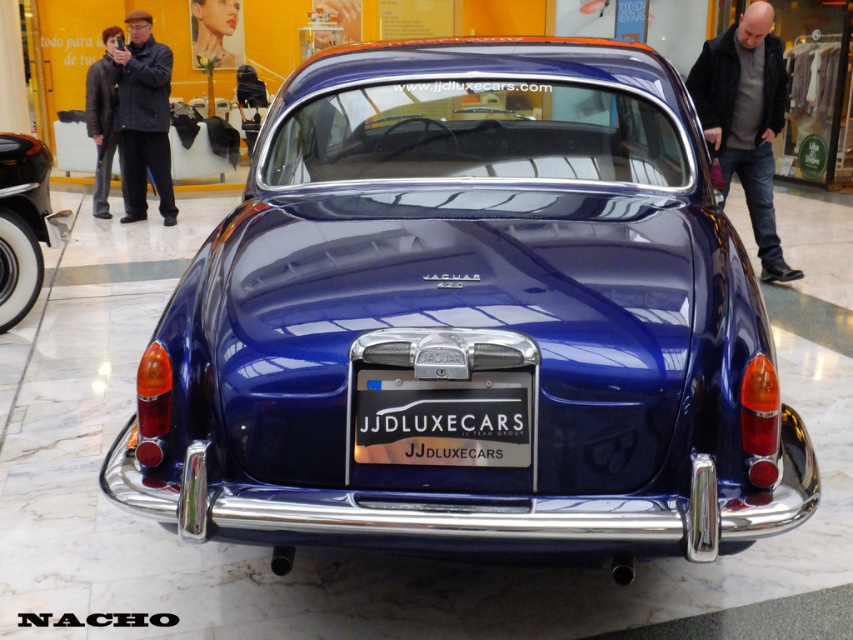
Consider the image. You are standing in front of the Jaguar car and want to take a photo. You notice two points marked on the car. One is at point coordinates (422, 484) and the other is at (767, 72). Which point will appear larger in your photo?

Point (422, 484) is closer to the camera than point (767, 72). Since objects closer to the camera appear larger in photos, the point at (422, 484) will appear larger in the photo.

In the scene shown: You are a photographer setting up a shoot in the showroom where the classic Jaguar is displayed. You need to position a spotlight to highlight the black metallic license plate at center without casting a shadow on the white wall at left. Given their spatial relationship, where should you place the spotlight relative to the license plate?

The black metallic license plate at center is located below the white wall at left. To avoid casting a shadow on the white wall at left, the spotlight should be placed above the license plate so that the light shines downward, preventing the shadow from reaching the wall.

You are a photographer setting up a shoot in the showroom. You need to position a spotlight to illuminate the glossy blue car at center without casting a shadow on the white wall at left. Based on the scene description, where should you place the spotlight relative to the car and the wall?

The glossy blue car at center is positioned under the white wall at left. To avoid casting a shadow on the white wall at left, the spotlight should be placed above and behind the glossy blue car at center, directing light downward so the shadow falls behind the car instead of onto the wall.